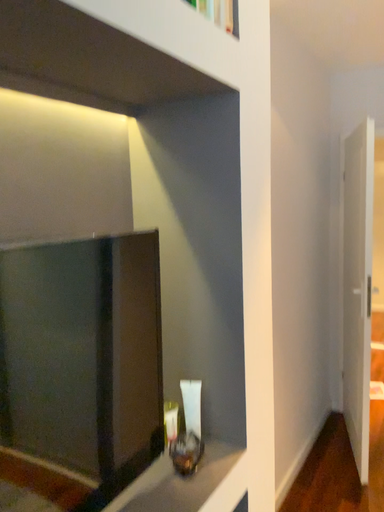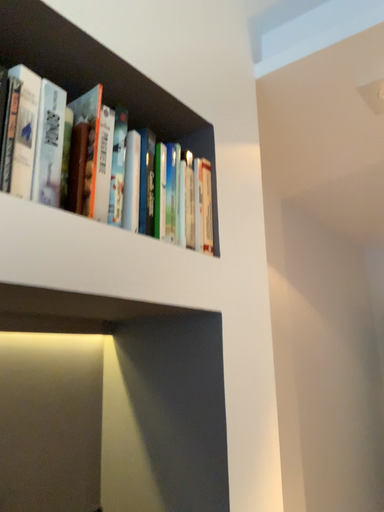
Question: Which way did the camera rotate in the video?

Choices:
 (A) rotated left
 (B) rotated right

Answer: (A)